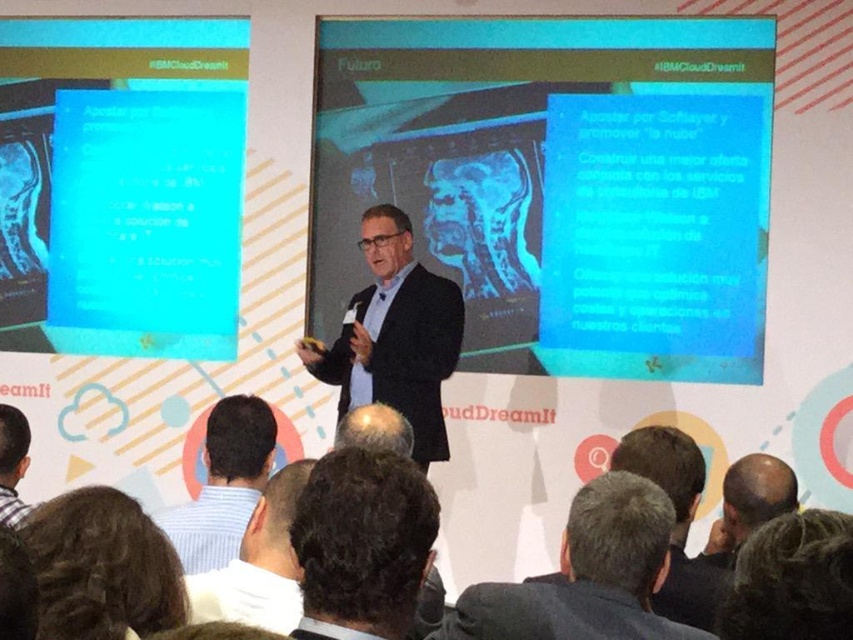
Can you confirm if dark gray fabric business suit at lower center is positioned below striped shirt at lower left?

Indeed, dark gray fabric business suit at lower center is positioned under striped shirt at lower left.

Is dark gray fabric business suit at lower center closer to camera compared to striped shirt at lower left?

Yes.

The height and width of the screenshot is (640, 853). I want to click on dark gray fabric business suit at lower center, so click(555, 614).

Looking at this image, between dark gray suit at center and dark gray fabric business suit at lower center, which one has less height?

dark gray fabric business suit at lower center is shorter.

Based on the photo, is dark gray suit at center below dark gray fabric business suit at lower center?

Incorrect, dark gray suit at center is not positioned below dark gray fabric business suit at lower center.

Find the location of `dark gray suit at center`. dark gray suit at center is located at coordinates (585, 576).

Which is more to the left, blue glossy text box at center or black wool suit at center?

black wool suit at center is more to the left.

Between blue glossy text box at center and black wool suit at center, which one is positioned lower?

black wool suit at center is below.

What do you see at coordinates (560, 182) in the screenshot?
I see `blue glossy text box at center` at bounding box center [560, 182].

Find the location of `blue glossy text box at center`. blue glossy text box at center is located at coordinates (560, 182).